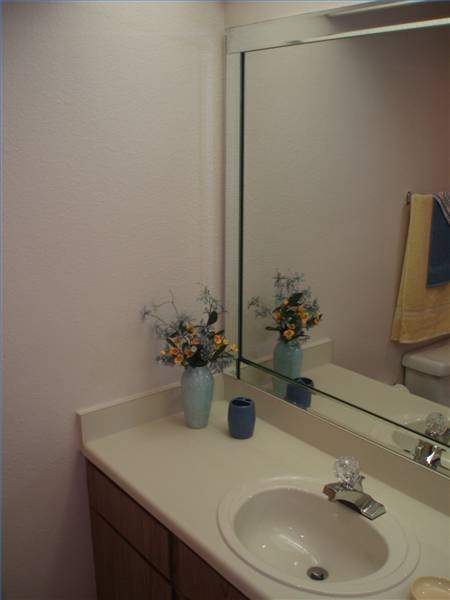
Locate an element on the screen. wall is located at coordinates (52, 473).